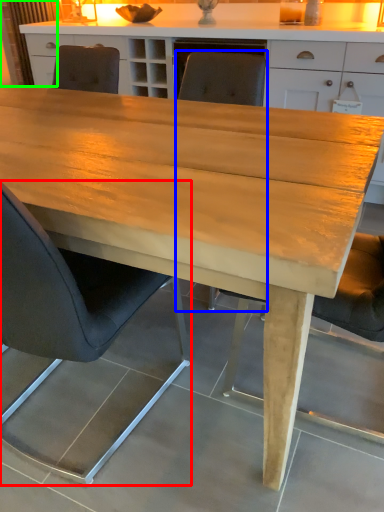
Question: Which object is positioned farthest from chair (highlighted by a red box)? Select from chair (highlighted by a blue box) and curtain (highlighted by a green box).

Choices:
 (A) chair
 (B) curtain

Answer: (B)